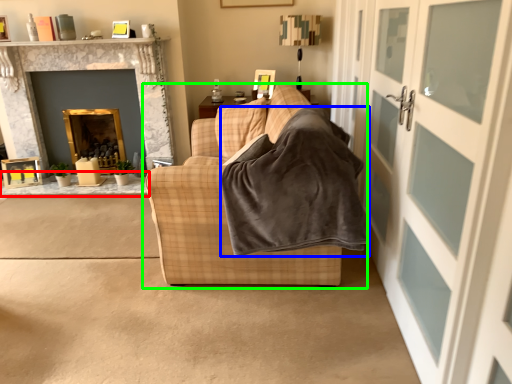
Question: Based on their relative distances, which object is nearer to table (highlighted by a red box)? Choose from blanket (highlighted by a blue box) and studio couch (highlighted by a green box).

Choices:
 (A) blanket
 (B) studio couch

Answer: (B)